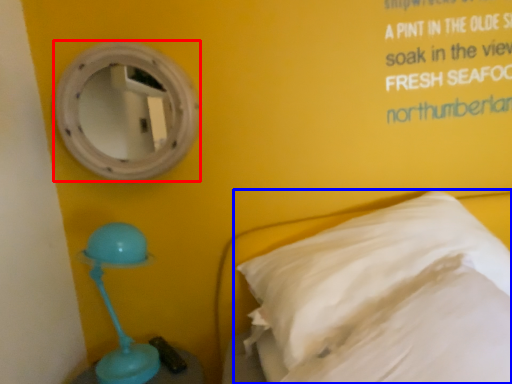
Question: Which point is further to the camera, mirror (highlighted by a red box) or pillow (highlighted by a blue box)?

Choices:
 (A) mirror
 (B) pillow

Answer: (A)